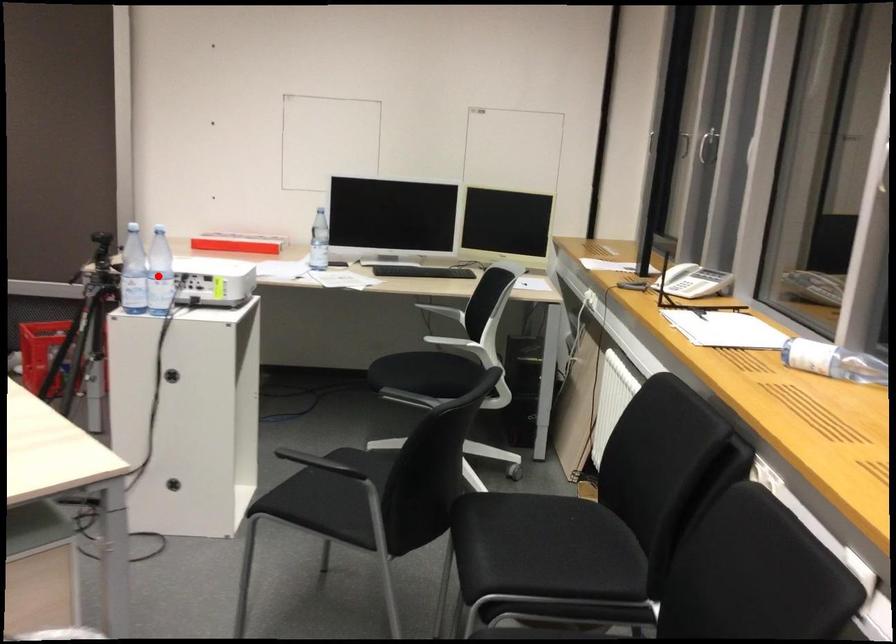
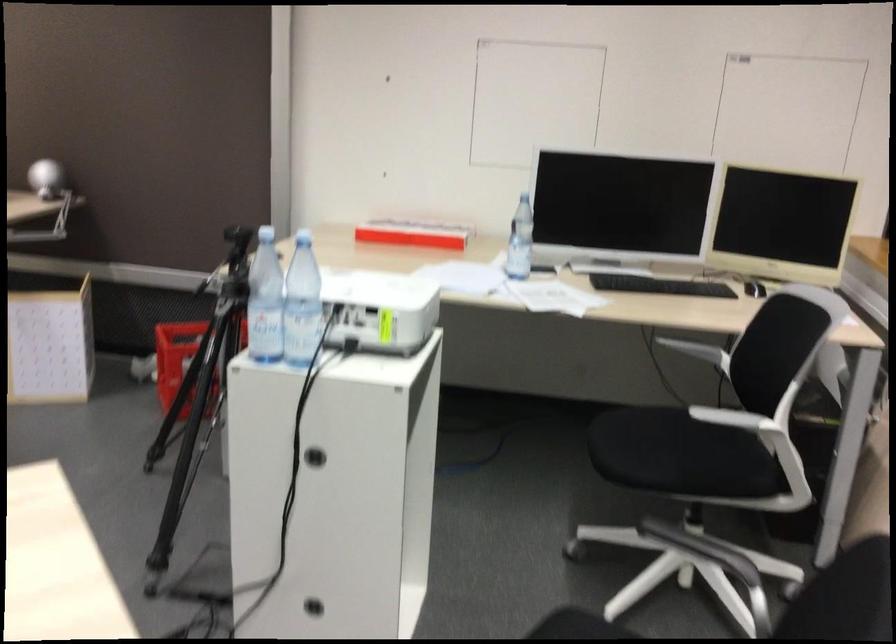
Locate, in the second image, the point that corresponds to the highlighted location in the first image.

(302, 303)